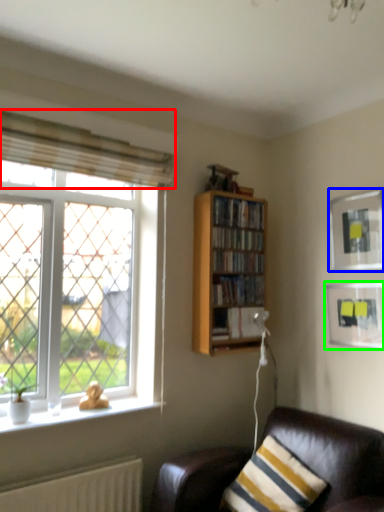
Question: Estimate the real-world distances between objects in this image. Which object is farther from curtain (highlighted by a red box), picture frame (highlighted by a blue box) or picture frame (highlighted by a green box)?

Choices:
 (A) picture frame
 (B) picture frame

Answer: (B)